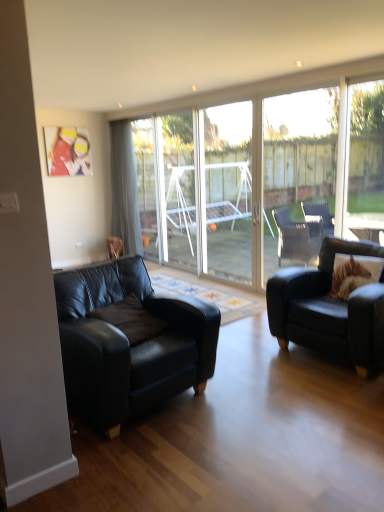
Question: Considering the relative sizes of brown textured pillow at right and black leather couch at left, which appears as the second studio couch when viewed from the right, in the image provided, is brown textured pillow at right wider than black leather couch at left, which appears as the second studio couch when viewed from the right,?

Choices:
 (A) yes
 (B) no

Answer: (B)

Question: Is brown textured pillow at right smaller than black leather couch at left, which is counted as the 1th studio couch, starting from the left?

Choices:
 (A) no
 (B) yes

Answer: (B)

Question: Can you confirm if brown textured pillow at right is positioned to the left of black leather couch at left, which is counted as the 1th studio couch, starting from the left?

Choices:
 (A) no
 (B) yes

Answer: (A)

Question: Can we say brown textured pillow at right lies outside black leather couch at left, which is counted as the 1th studio couch, starting from the left?

Choices:
 (A) yes
 (B) no

Answer: (A)

Question: From the image's perspective, is brown textured pillow at right below black leather couch at left, which is counted as the 1th studio couch, starting from the left?

Choices:
 (A) yes
 (B) no

Answer: (B)

Question: Relative to black leather couch at left, which appears as the second studio couch when viewed from the right, is transparent glass door at center, the second window when ordered from back to front, in front or behind?

Choices:
 (A) behind
 (B) front

Answer: (A)

Question: Based on their positions, is transparent glass door at center, which appears as the second window when viewed from the left, located to the left or right of black leather couch at left, which appears as the second studio couch when viewed from the right?

Choices:
 (A) right
 (B) left

Answer: (A)

Question: Is point (329, 96) closer or farther from the camera than point (112, 423)?

Choices:
 (A) farther
 (B) closer

Answer: (A)

Question: From their relative heights in the image, would you say transparent glass door at center, which appears as the second window when viewed from the left, is taller or shorter than black leather couch at left, which appears as the second studio couch when viewed from the right?

Choices:
 (A) tall
 (B) short

Answer: (A)

Question: Is transparent glass door at center wider or thinner than gray fabric curtain at left?

Choices:
 (A) wide
 (B) thin

Answer: (B)

Question: From the image's perspective, is transparent glass door at center positioned above or below gray fabric curtain at left?

Choices:
 (A) below
 (B) above

Answer: (A)

Question: Considering the positions of transparent glass door at center and gray fabric curtain at left in the image, is transparent glass door at center bigger or smaller than gray fabric curtain at left?

Choices:
 (A) big
 (B) small

Answer: (B)

Question: Considering their positions, is transparent glass door at center located in front of or behind gray fabric curtain at left?

Choices:
 (A) front
 (B) behind

Answer: (A)

Question: Is point (109, 155) positioned closer to the camera than point (223, 166)?

Choices:
 (A) farther
 (B) closer

Answer: (A)

Question: From the image's perspective, is gray fabric curtain at left located above or below transparent glass screen door at center?

Choices:
 (A) below
 (B) above

Answer: (B)